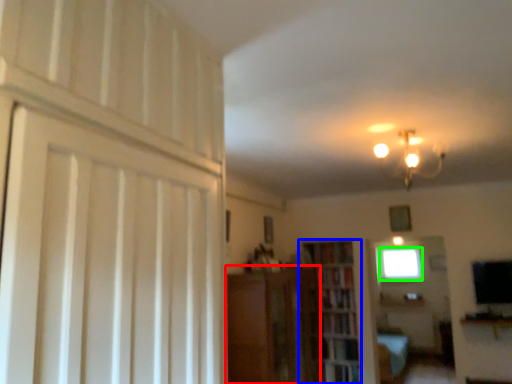
Question: Which object is the farthest from cabinetry (highlighted by a red box)? Choose among these: bookcase (highlighted by a blue box) or window (highlighted by a green box).

Choices:
 (A) bookcase
 (B) window

Answer: (B)